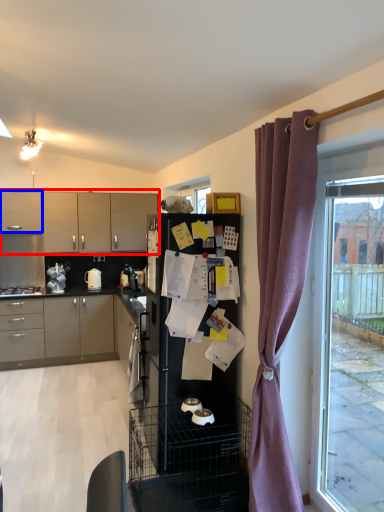
Question: Which object is closer to the camera taking this photo, cabinetry (highlighted by a red box) or cabinetry (highlighted by a blue box)?

Choices:
 (A) cabinetry
 (B) cabinetry

Answer: (B)